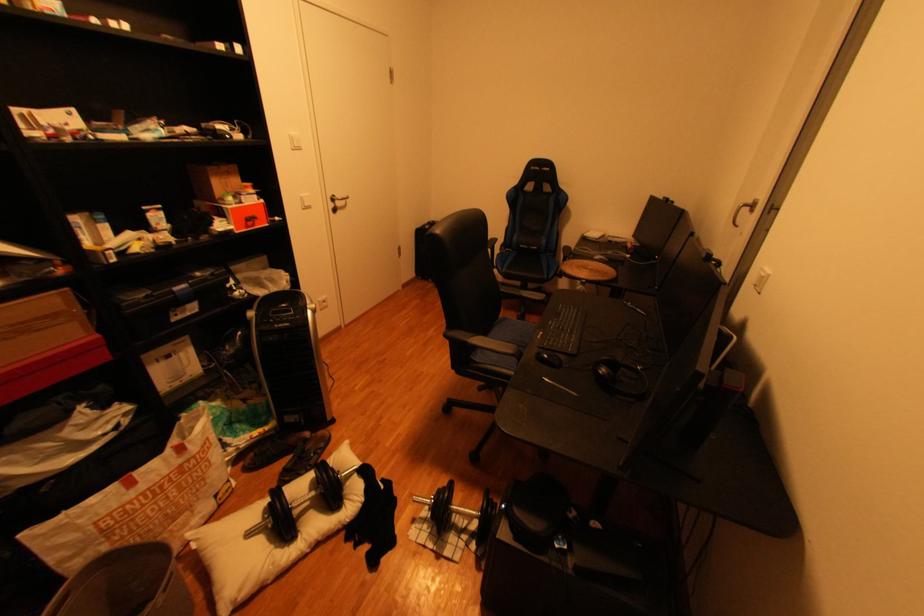
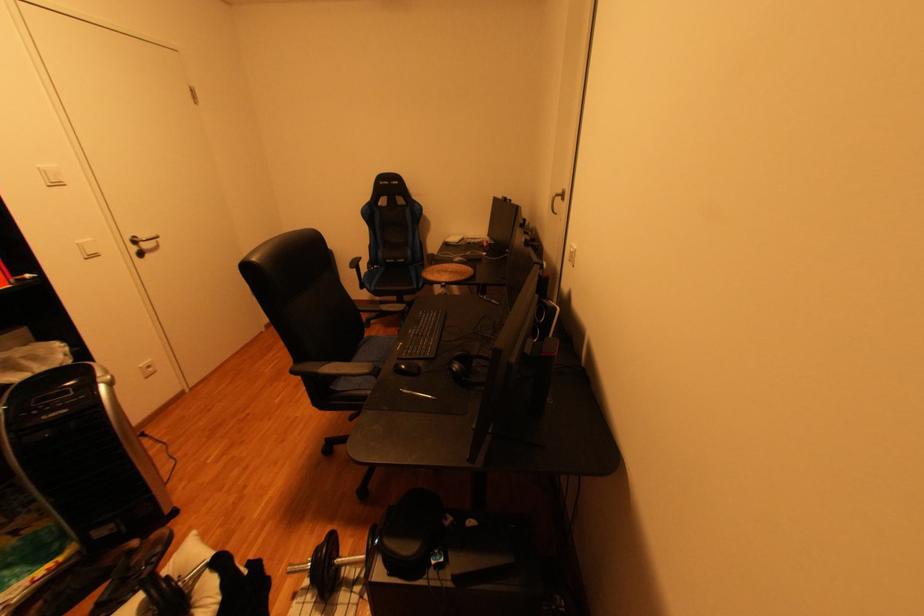
Find the pixel in the second image that matches [439,530] in the first image.

(323, 600)